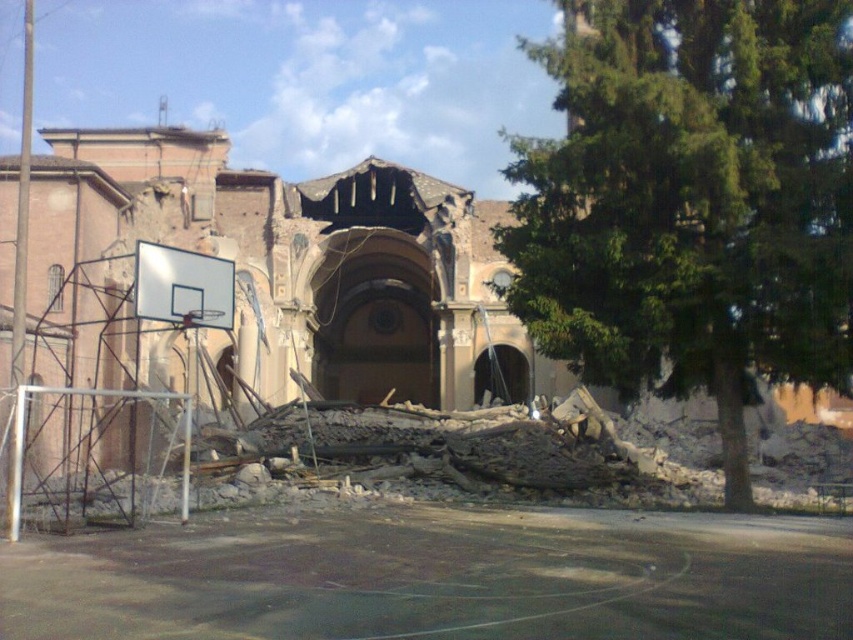
From the picture: Can you confirm if green leafy tree at center is positioned below smooth asphalt basketball court at lower center?

Incorrect, green leafy tree at center is not positioned below smooth asphalt basketball court at lower center.

The width and height of the screenshot is (853, 640). Describe the element at coordinates (692, 200) in the screenshot. I see `green leafy tree at center` at that location.

Does point (518, 168) come closer to viewer compared to point (178, 620)?

No, (518, 168) is further to viewer.

Identify the location of green leafy tree at center. This screenshot has height=640, width=853. (692, 200).